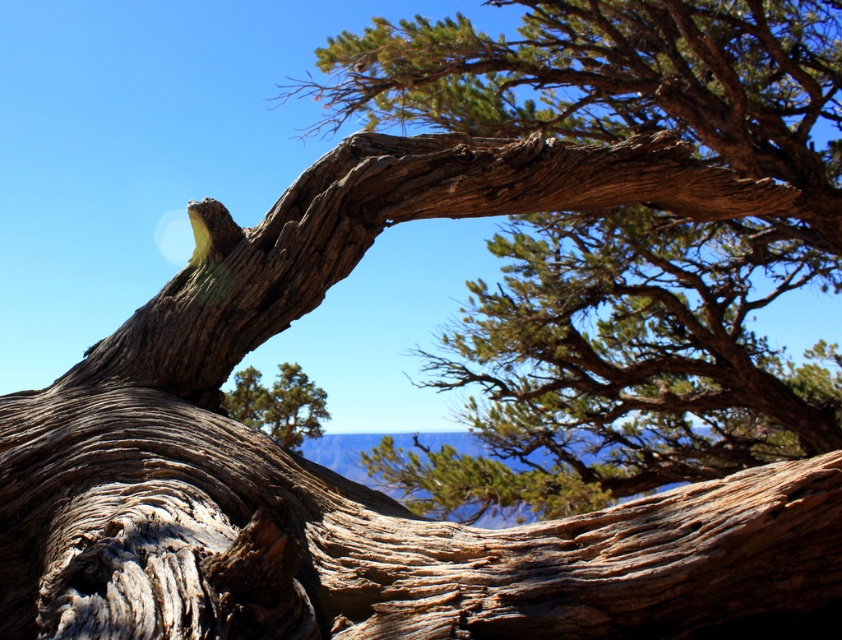
You are an environmental researcher observing the desert landscape. You notice the rough bark tree at upper center and the green textured pine tree at center. Which tree would cast a longer shadow during midday when the sun is directly overhead?

The rough bark tree at upper center is larger in size than the green textured pine tree at center, so it would cast a longer shadow during midday when the sun is directly overhead.

You are a hiker trying to determine the tallest tree between the rough bark tree at upper center and the green textured pine tree at center. Which one is taller?

The rough bark tree at upper center is much taller than the green textured pine tree at center.